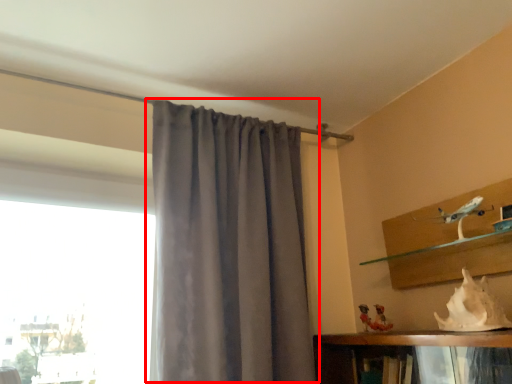
Question: From the image's perspective, what is the correct spatial relationship of curtain (annotated by the red box) in relation to animal?

Choices:
 (A) below
 (B) above

Answer: (B)